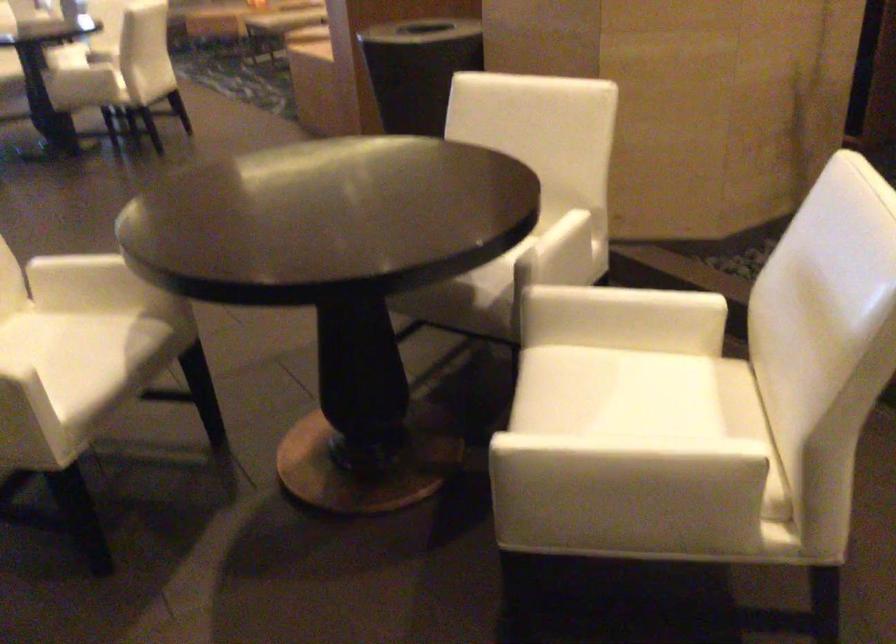
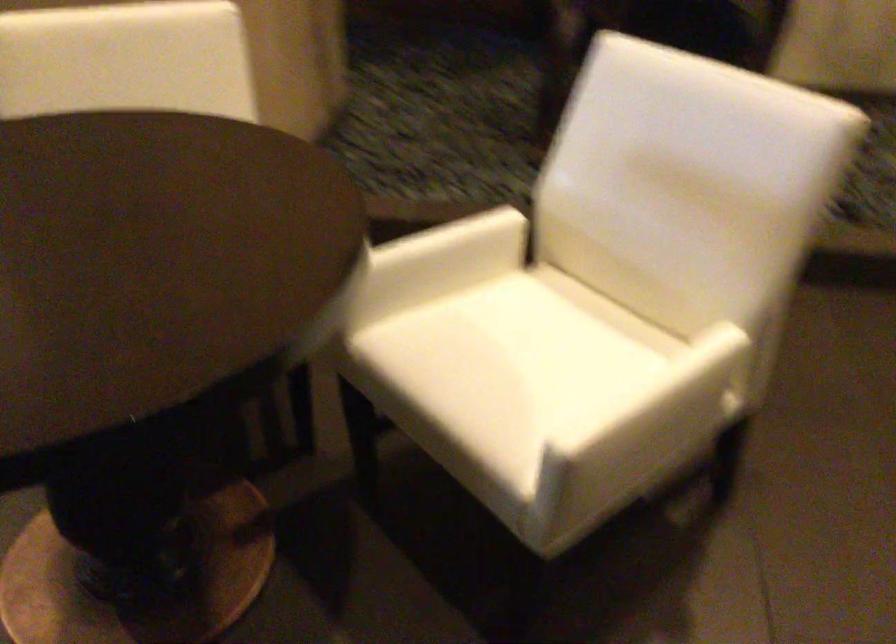
Question: The camera is either moving clockwise (left) or counter-clockwise (right) around the object. The first image is from the beginning of the video and the second image is from the end. Is the camera moving left or right when shooting the video?

Choices:
 (A) Left
 (B) Right

Answer: (A)